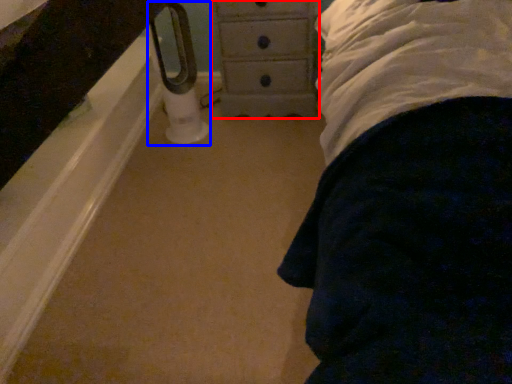
Question: Among these objects, which one is farthest to the camera, chest of drawers (highlighted by a red box) or towel bar (highlighted by a blue box)?

Choices:
 (A) chest of drawers
 (B) towel bar

Answer: (A)